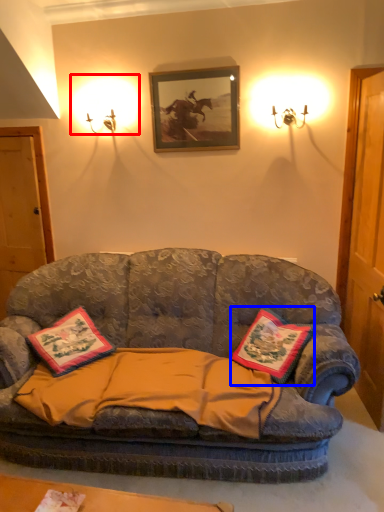
Question: Among these objects, which one is nearest to the camera, lighting (highlighted by a red box) or pillow (highlighted by a blue box)?

Choices:
 (A) lighting
 (B) pillow

Answer: (B)